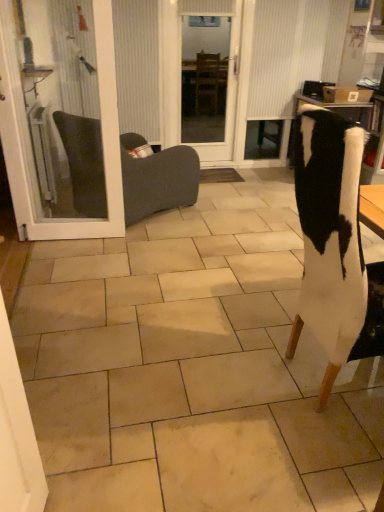
The height and width of the screenshot is (512, 384). Find the location of `spots to the right of dark gray fabric chair at left, acting as the 1th chair starting from the left`. spots to the right of dark gray fabric chair at left, acting as the 1th chair starting from the left is located at coordinates (225, 211).